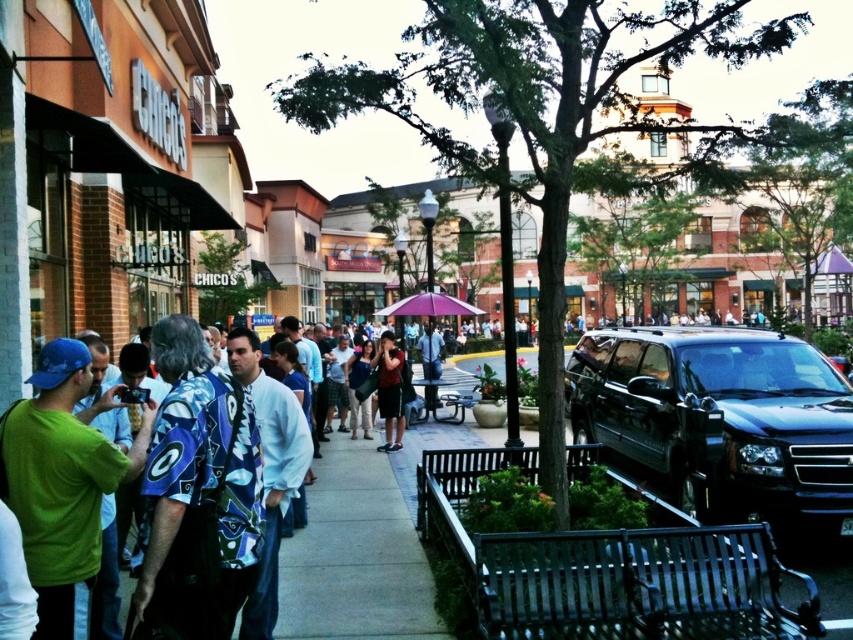
Question: Estimate the real-world distances between objects in this image. Which object is farther from the purple fabric umbrella at center?

Choices:
 (A) dark blue shirt at center
 (B) shiny black suv at center

Answer: (B)

Question: Is shiny black suv at center above purple fabric umbrella at center?

Choices:
 (A) yes
 (B) no

Answer: (B)

Question: Is dark blue shirt at center thinner than purple fabric umbrella at center?

Choices:
 (A) no
 (B) yes

Answer: (B)

Question: Is shiny black suv at center smaller than dark blue shirt at center?

Choices:
 (A) no
 (B) yes

Answer: (A)

Question: Which point is farther to the camera?

Choices:
 (A) (393, 308)
 (B) (683, 483)
 (C) (381, 445)

Answer: (A)

Question: Which of the following is the closest to the observer?

Choices:
 (A) click(397, 362)
 (B) click(654, 384)
 (C) click(399, 300)

Answer: (B)